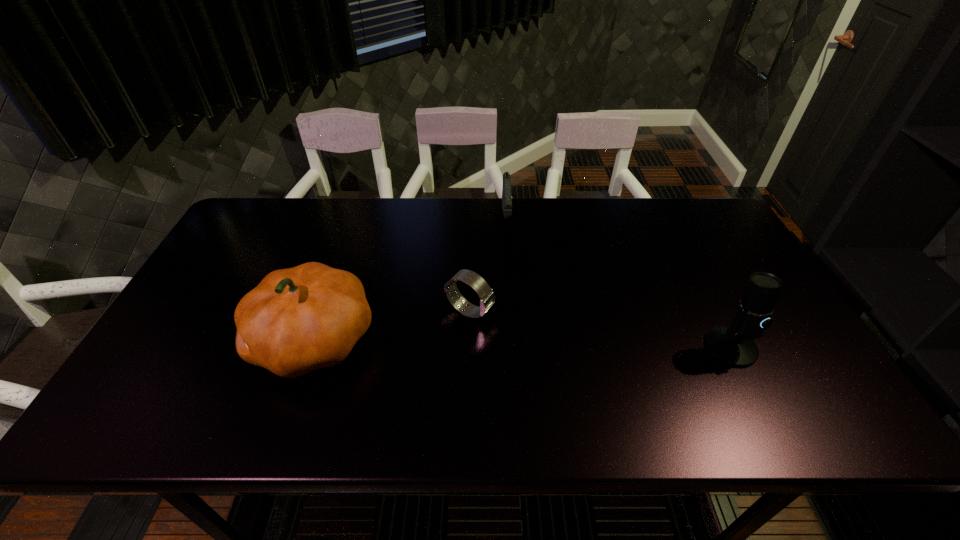
Find the location of a particular element. vacant area between the pumpkin and the rightmost object is located at coordinates (522, 343).

I want to click on unoccupied position between the farthest object and the second object from left to right, so click(488, 265).

Where is `blank region between the microphone and the leftmost object`? blank region between the microphone and the leftmost object is located at coordinates (522, 343).

Locate an element on the screen. This screenshot has width=960, height=540. unoccupied area between the farthest object and the pumpkin is located at coordinates (410, 279).

Image resolution: width=960 pixels, height=540 pixels. I want to click on empty space that is in between the watch and the rightmost object, so click(x=600, y=329).

Locate which object ranks third in proximity to the farthest object. Please provide its 2D coordinates. Your answer should be formatted as a tuple, i.e. [(x, y)], where the tuple contains the x and y coordinates of a point satisfying the conditions above.

[(733, 345)]

The height and width of the screenshot is (540, 960). In order to click on object that is the second nearest to the third object from right to left in this screenshot , I will do `click(506, 190)`.

Identify the location of blank space that satisfies the following two spatial constraints: 1. on the front side of the second object from left to right; 2. on the left side of the rightmost object. (468, 347).